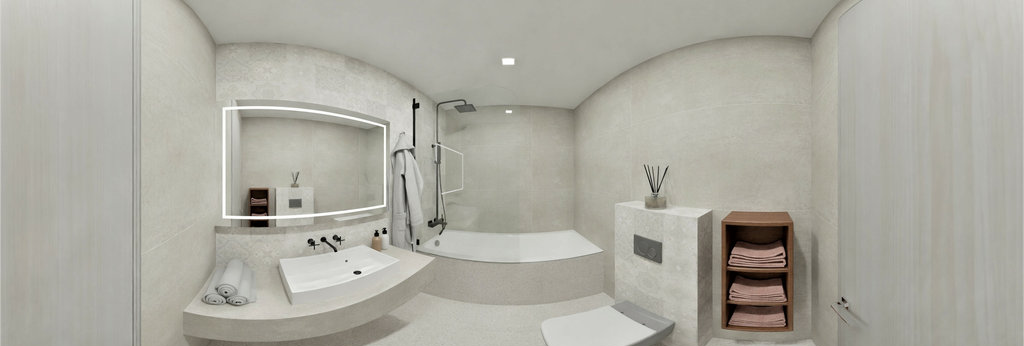
The image size is (1024, 346). Find the location of `sink`. sink is located at coordinates (341, 280).